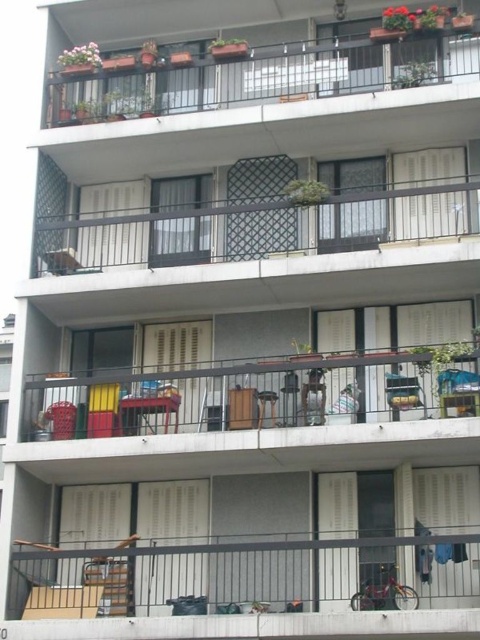
Question: Does metallic gray railing at lower center appear on the right side of metallic silver chair at center?

Choices:
 (A) no
 (B) yes

Answer: (A)

Question: Does metallic gray railing at lower center come in front of metallic silver chair at center?

Choices:
 (A) yes
 (B) no

Answer: (A)

Question: Which point is farther from the camera taking this photo?

Choices:
 (A) (287, 468)
 (B) (420, 404)
 (C) (359, 554)

Answer: (A)

Question: Can you confirm if metallic gray railing at lower center is wider than metallic gray furniture at lower left?

Choices:
 (A) no
 (B) yes

Answer: (A)

Question: Considering the real-world distances, which object is closest to the metallic gray furniture at lower left?

Choices:
 (A) metallic silver chair at center
 (B) metallic gray railing at lower center

Answer: (A)

Question: Which object appears closest to the camera in this image?

Choices:
 (A) metallic silver chair at center
 (B) metallic gray railing at lower center

Answer: (B)